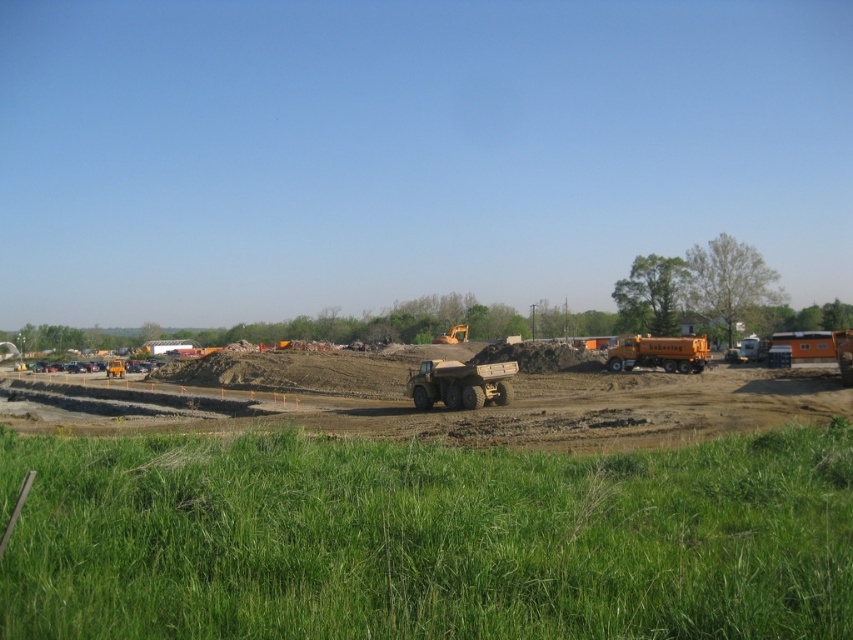
Question: Which point appears closest to the camera in this image?

Choices:
 (A) (726, 637)
 (B) (395, 364)

Answer: (A)

Question: Where is green grass at lower center located in relation to matte yellow truck at center in the image?

Choices:
 (A) above
 (B) below

Answer: (A)

Question: Which point is closer to the camera taking this photo?

Choices:
 (A) pos(166,545)
 (B) pos(358,376)

Answer: (A)

Question: Among these objects, which one is farthest from the camera?

Choices:
 (A) matte yellow truck at center
 (B) green grass at lower center

Answer: (A)

Question: Does green grass at lower center appear on the right side of matte yellow truck at center?

Choices:
 (A) yes
 (B) no

Answer: (A)

Question: In this image, where is green grass at lower center located relative to matte yellow truck at center?

Choices:
 (A) left
 (B) right

Answer: (B)